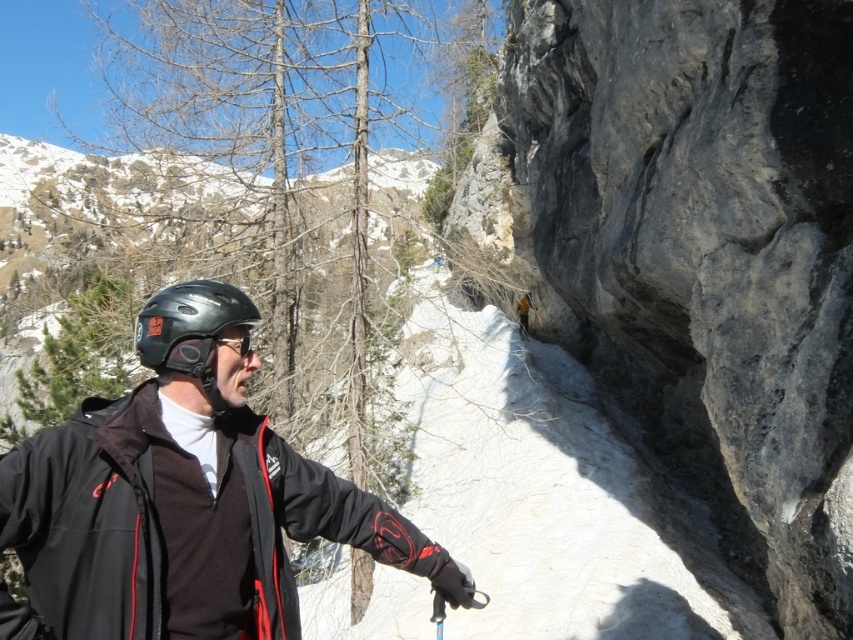
Question: Among these objects, which one is farthest from the camera?

Choices:
 (A) matte black helmet at left
 (B) black matte goggles at center

Answer: (B)

Question: Does matte black goggles at center appear on the right side of black matte goggles at center?

Choices:
 (A) no
 (B) yes

Answer: (B)

Question: Where is matte black helmet at left located in relation to black matte goggles at center in the image?

Choices:
 (A) below
 (B) above

Answer: (B)

Question: Which point is closer to the camera?

Choices:
 (A) white powdery snow at center
 (B) black softshell jacket at left
 (C) black matte goggles at center
 (D) matte black goggles at center

Answer: (B)

Question: Which object is closer to the camera taking this photo?

Choices:
 (A) black matte goggles at center
 (B) white powdery snow at center
 (C) matte black goggles at center
 (D) black softshell jacket at left

Answer: (D)

Question: In this image, where is white powdery snow at center located relative to matte black helmet at left?

Choices:
 (A) left
 (B) right

Answer: (A)